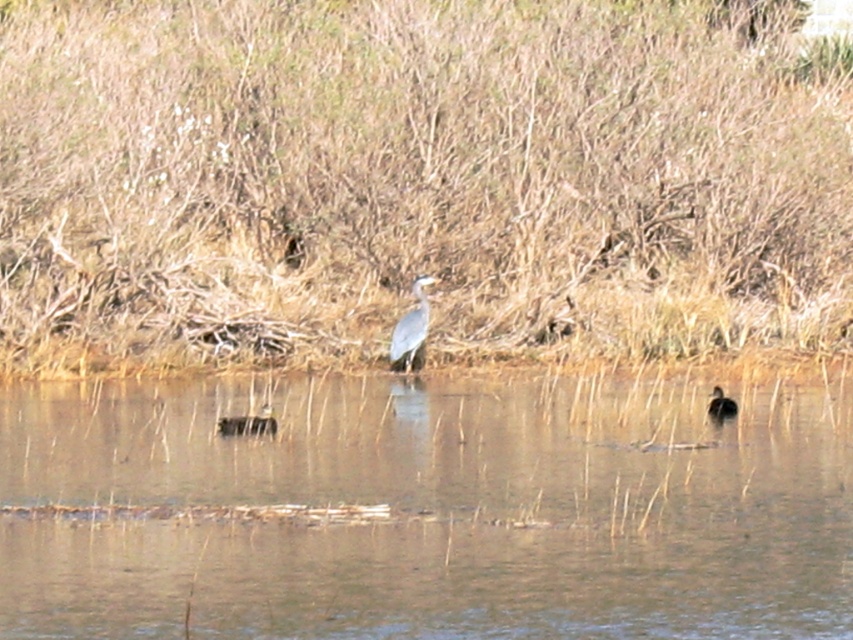
Is point (350, 257) farther from camera compared to point (714, 422)?

That is True.

Does brown dry grass at center have a lesser height compared to brown speckled duck at right?

Incorrect, brown dry grass at center's height does not fall short of brown speckled duck at right's.

Who is more forward, (38, 211) or (714, 397)?

Point (714, 397) is more forward.

Locate an element on the screen. brown dry grass at center is located at coordinates (416, 180).

Find the location of a particular element. brown dry grass at center is located at coordinates (416, 180).

Is point (750, 68) less distant than point (534, 436)?

No, (750, 68) is further to viewer.

Does point (148, 180) lie in front of point (746, 532)?

No, it is not.

Where is `brown dry grass at center`? brown dry grass at center is located at coordinates (416, 180).

Is brown matte water at center above gray matte bird at center?

Actually, brown matte water at center is below gray matte bird at center.

Which of these two, brown matte water at center or gray matte bird at center, stands taller?

brown matte water at center

What do you see at coordinates (424, 509) in the screenshot? I see `brown matte water at center` at bounding box center [424, 509].

At what (x,y) coordinates should I click in order to perform the action: click on brown matte water at center. Please return your answer as a coordinate pair (x, y). The width and height of the screenshot is (853, 640). Looking at the image, I should click on pyautogui.click(x=424, y=509).